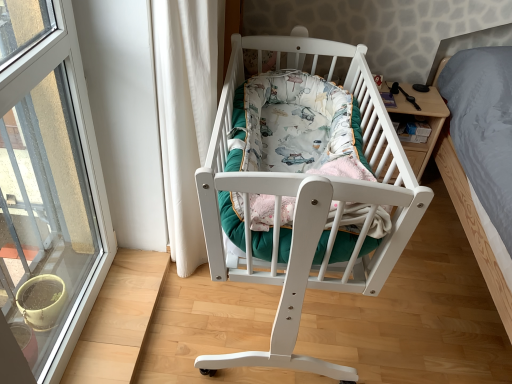
Question: Do you think white wood crib at center is within printed fabric mattress at center, or outside of it?

Choices:
 (A) inside
 (B) outside

Answer: (B)

Question: In the image, is white wood crib at center positioned in front of or behind printed fabric mattress at center?

Choices:
 (A) front
 (B) behind

Answer: (B)

Question: Which is nearer to the wooden nightstand at right?

Choices:
 (A) white wood crib at center
 (B) transparent glass window at left
 (C) printed fabric mattress at center

Answer: (C)

Question: Estimate the real-world distances between objects in this image. Which object is closer to the white wood crib at center?

Choices:
 (A) wooden nightstand at right
 (B) printed fabric mattress at center
 (C) transparent glass window at left

Answer: (B)